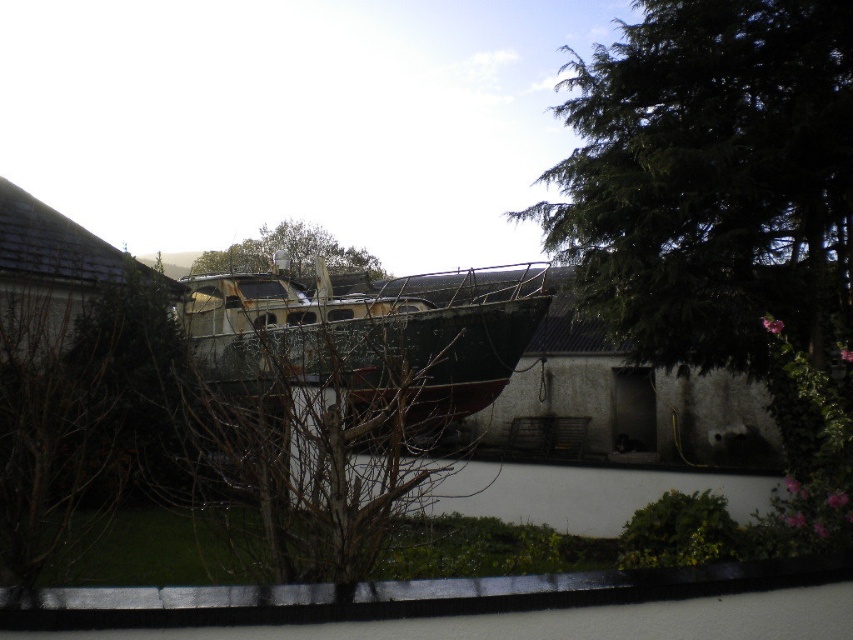
Who is more distant from viewer, (465, 380) or (233, 253)?

The point (233, 253) is more distant.

Is point (335, 518) behind point (265, 240)?

That is False.

Who is more distant from viewer, (184, 324) or (378, 273)?

The point (378, 273) is behind.

The height and width of the screenshot is (640, 853). Find the location of `brown rough bark tree at center`. brown rough bark tree at center is located at coordinates (341, 387).

Is point (744, 250) closer to camera compared to point (422, 369)?

No, it is behind (422, 369).

Does green needle-like leaves at upper right have a lesser width compared to rusty metal boat at center?

Indeed, green needle-like leaves at upper right has a lesser width compared to rusty metal boat at center.

You are a GUI agent. You are given a task and a screenshot of the screen. Output one action in this format:
    pyautogui.click(x=<x>, y=<y>)
    Task: Click on the green needle-like leaves at upper right
    
    Given the screenshot: What is the action you would take?
    pyautogui.click(x=712, y=179)

Identify the location of green needle-like leaves at upper right. The height and width of the screenshot is (640, 853). (712, 179).

Can you confirm if brown rough bark tree at center is positioned to the right of rusty metal boat at center?

Yes, brown rough bark tree at center is to the right of rusty metal boat at center.

Between brown rough bark tree at center and rusty metal boat at center, which one appears on the left side from the viewer's perspective?

From the viewer's perspective, rusty metal boat at center appears more on the left side.

I want to click on brown rough bark tree at center, so click(341, 387).